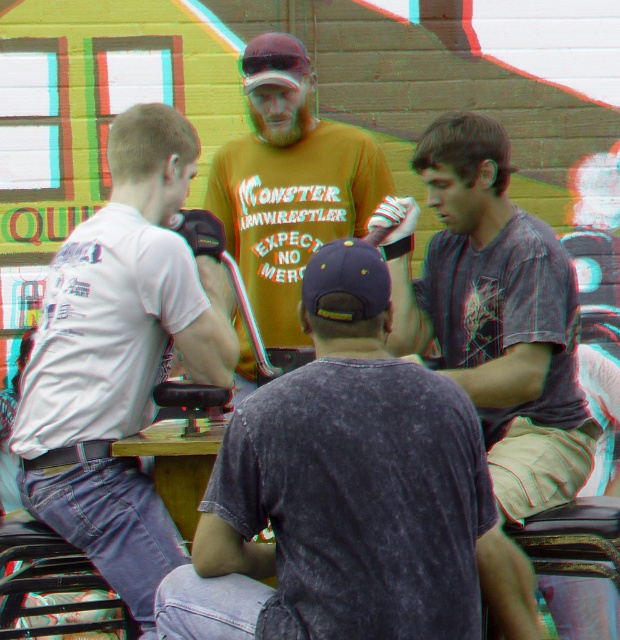
Question: Which point appears farthest from the camera in this image?

Choices:
 (A) (450, 516)
 (B) (272, 266)
 (C) (559, 461)

Answer: (B)

Question: Does white matte t-shirt at left have a lesser width compared to matte yellow t-shirt at center?

Choices:
 (A) no
 (B) yes

Answer: (B)

Question: Which point appears farthest from the camera in this image?

Choices:
 (A) (365, 600)
 (B) (347, 282)

Answer: (B)

Question: Does dark gray striped shirt at center appear over matte yellow t-shirt at center?

Choices:
 (A) yes
 (B) no

Answer: (B)

Question: Is white matte t-shirt at left bigger than dark gray striped shirt at center?

Choices:
 (A) no
 (B) yes

Answer: (B)

Question: Which point is farther from the camera taking this photo?

Choices:
 (A) (223, 292)
 (B) (388, 346)
 (C) (334, 177)
 (D) (316, 305)

Answer: (C)